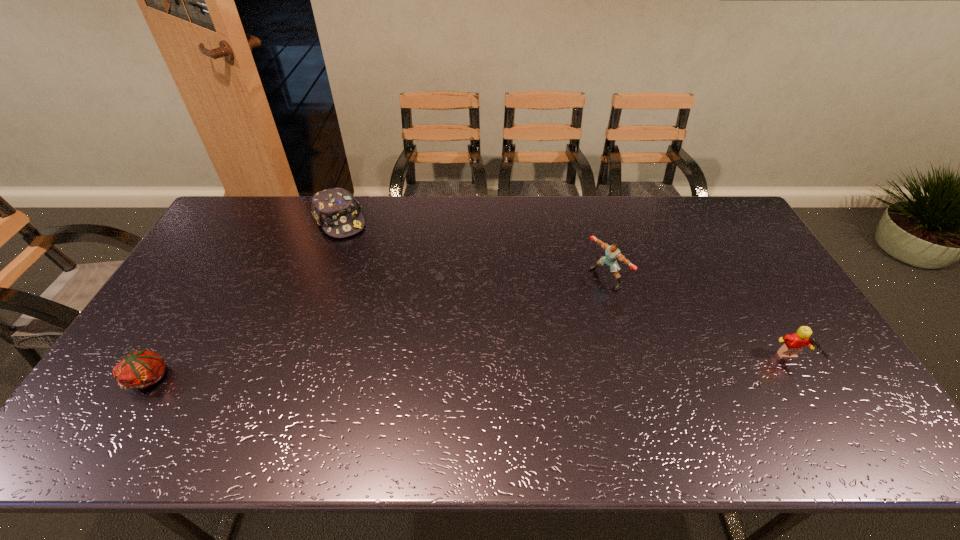
At what (x,y) coordinates should I click in order to perform the action: click on vacant space at the far edge. Please return your answer as a coordinate pair (x, y). Image resolution: width=960 pixels, height=540 pixels. Looking at the image, I should click on click(x=603, y=226).

This screenshot has width=960, height=540. What are the coordinates of `vacant space at the near edge` in the screenshot? It's located at (292, 396).

In the image, there is a desktop. Where is `vacant space at the left edge`? This screenshot has width=960, height=540. vacant space at the left edge is located at coordinates (215, 295).

Where is `free space at the right edge`? The image size is (960, 540). free space at the right edge is located at coordinates (763, 258).

What are the coordinates of `free space at the far left corner` in the screenshot? It's located at (257, 235).

Locate an element on the screen. This screenshot has width=960, height=540. empty space that is in between the second farthest object and the rightmost object is located at coordinates (699, 320).

The height and width of the screenshot is (540, 960). In order to click on vacant area that lies between the third object from right to left and the tomato in this screenshot , I will do `click(245, 299)`.

At what (x,y) coordinates should I click in order to perform the action: click on free area in between the rightmost object and the third nearest object. Please return your answer as a coordinate pair (x, y). Looking at the image, I should click on (699, 320).

The image size is (960, 540). What are the coordinates of `unoccupied area between the puncher and the Lego` in the screenshot? It's located at (699, 320).

The image size is (960, 540). What are the coordinates of `vacant space that is in between the tallest object and the farthest object` in the screenshot? It's located at click(x=472, y=249).